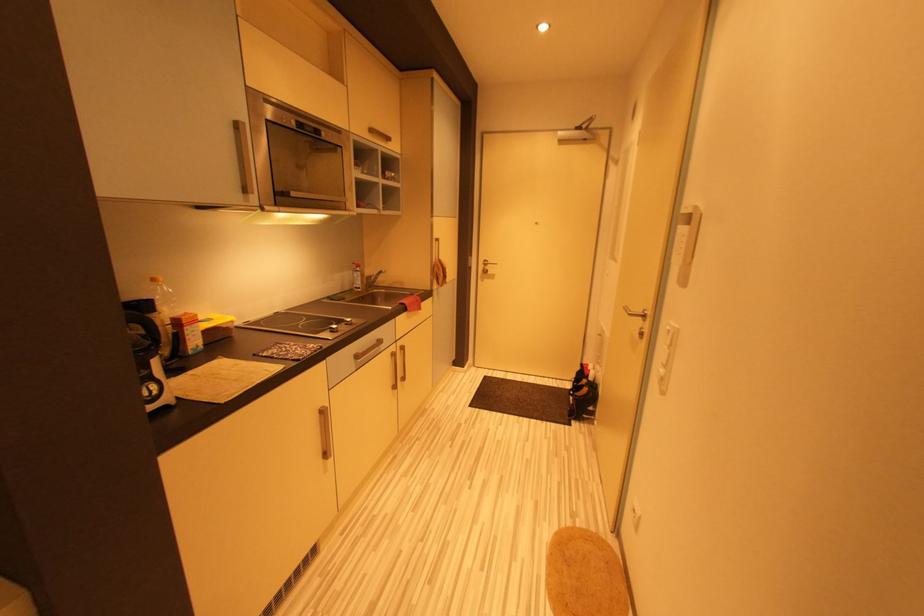
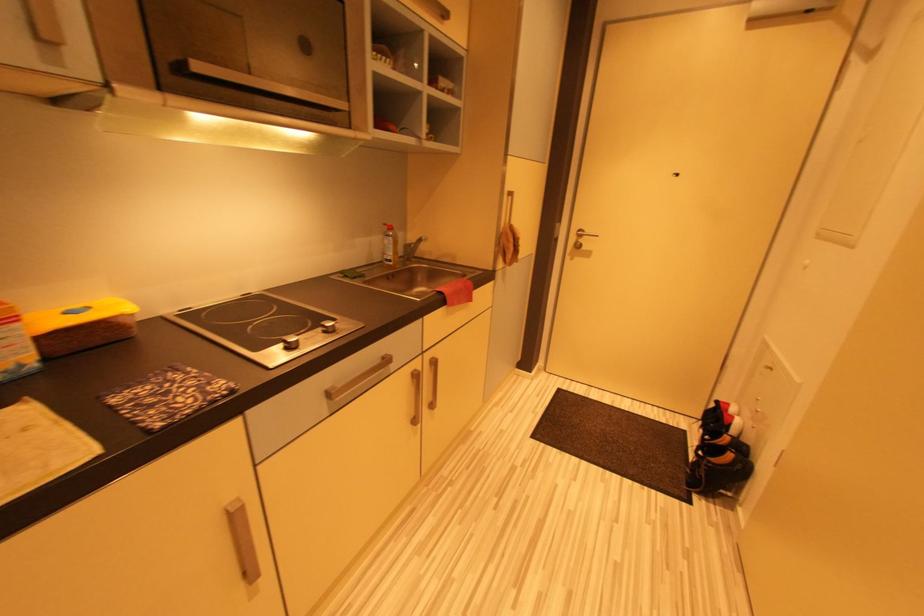
Question: In a continuous first-person perspective shot, in which direction is the camera moving?

Choices:
 (A) Left
 (B) Right
 (C) Forward
 (D) Backward

Answer: (C)